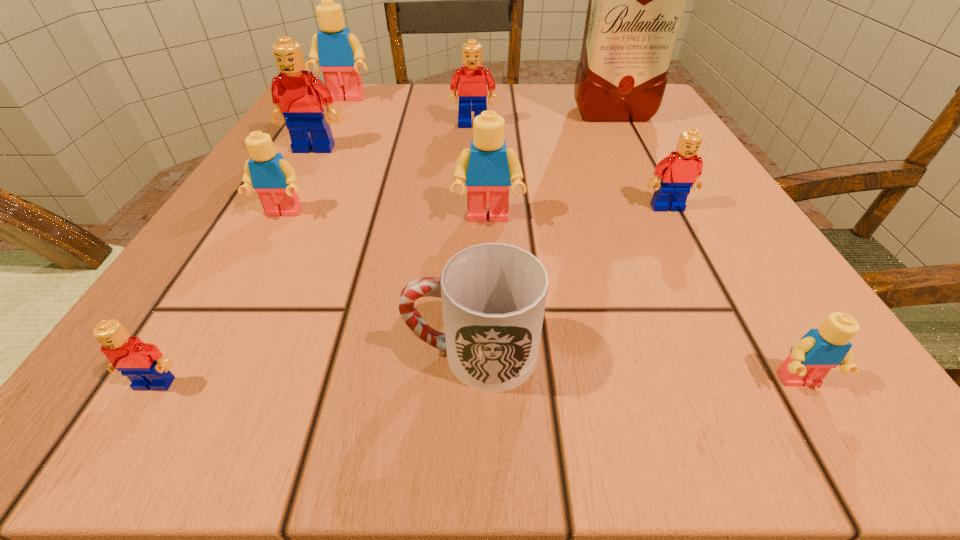
Locate an element on the screen. the third farthest red Lego is located at coordinates (679, 172).

Where is `cup`? cup is located at coordinates (493, 295).

Where is `the smallest yellow Lego`? the smallest yellow Lego is located at coordinates (819, 350).

You are a GUI agent. You are given a task and a screenshot of the screen. Output one action in this format:
    pyautogui.click(x=<x>, y=<y>)
    Task: Click on the nearest yellow Lego
    
    Given the screenshot: What is the action you would take?
    pyautogui.click(x=819, y=350)

This screenshot has width=960, height=540. I want to click on the smallest red Lego, so click(143, 363).

Image resolution: width=960 pixels, height=540 pixels. Find the location of `vacant space located on the front label of the liquor`. vacant space located on the front label of the liquor is located at coordinates (669, 227).

You are a GUI agent. You are given a task and a screenshot of the screen. Output one action in this format:
    pyautogui.click(x=<x>, y=<y>)
    Task: Click on the blank space located 0.390m on the front-facing side of the farthest yellow Lego
    
    Given the screenshot: What is the action you would take?
    pyautogui.click(x=281, y=219)

At what (x,y) coordinates should I click in order to perform the action: click on free spot located 0.380m on the front-facing side of the fourth farthest object. Please return your answer as a coordinate pair (x, y). Looking at the image, I should click on (217, 325).

Identify the location of vacant space situated on the front-facing side of the farthest red Lego. (471, 191).

Locate an element on the screen. This screenshot has height=540, width=960. free space located 0.270m on the front-facing side of the third yellow Lego from left to right is located at coordinates (492, 406).